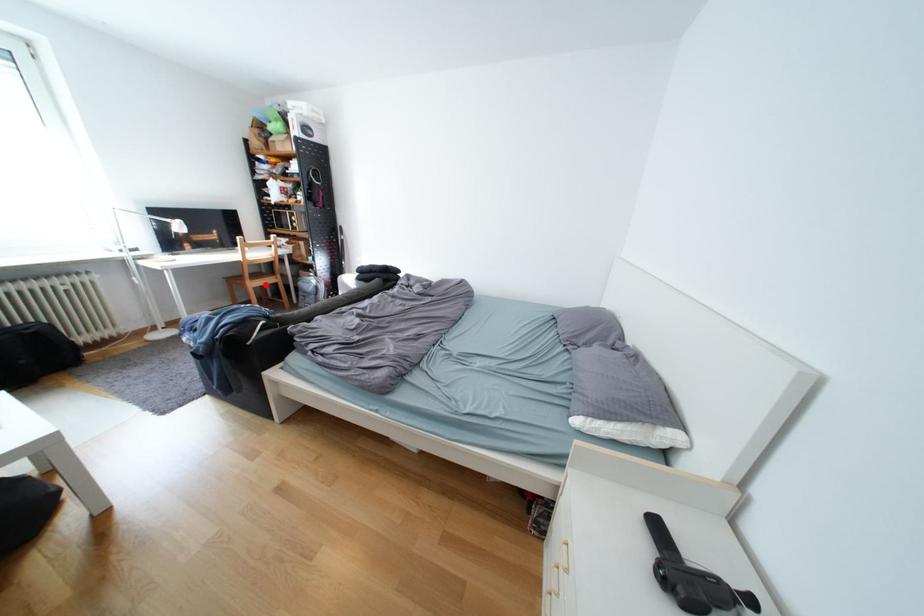
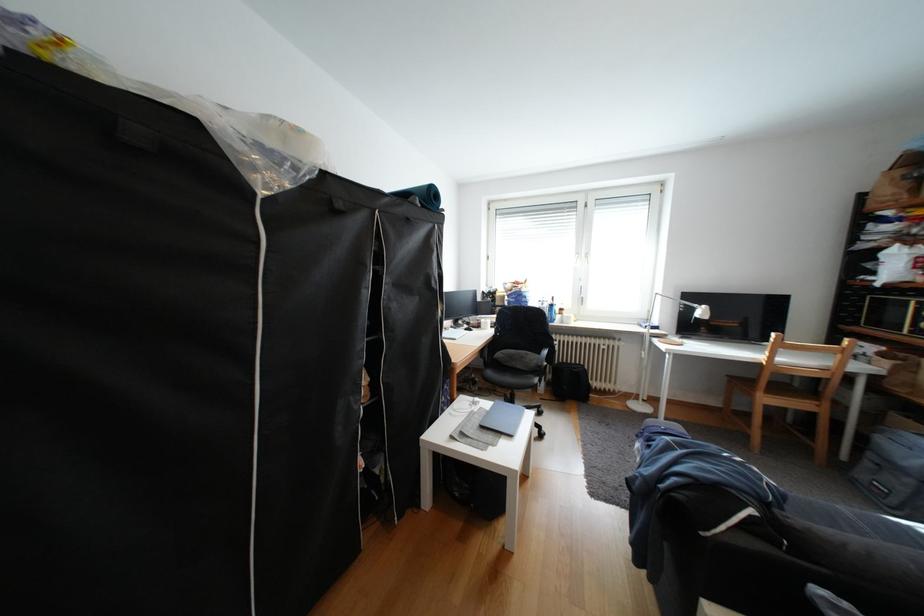
Where in the second image is the point corresponding to the highlighted location from the first image?

(779, 400)